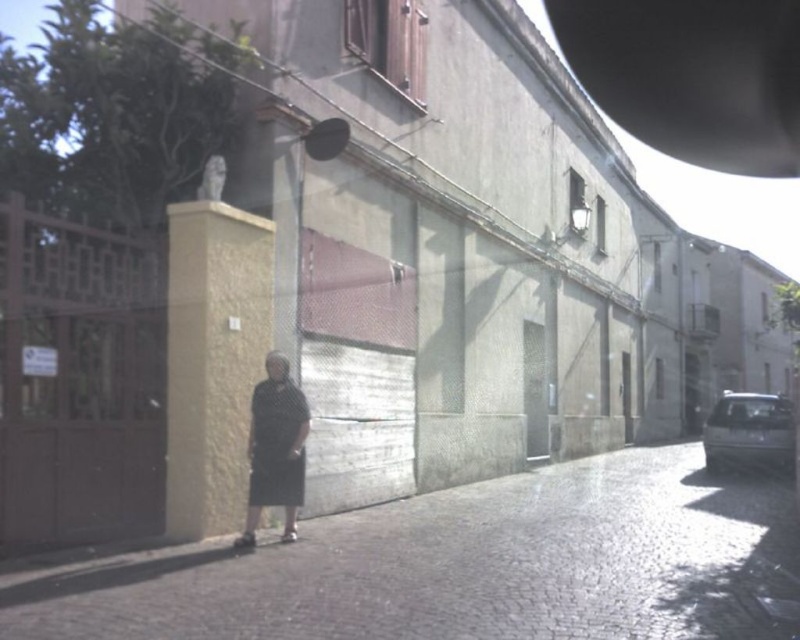
Consider the image. Can you confirm if dark gray cobblestone pavement at center is positioned to the right of black matte dress at lower center?

Correct, you'll find dark gray cobblestone pavement at center to the right of black matte dress at lower center.

Does dark gray cobblestone pavement at center come in front of black matte dress at lower center?

Yes, it is in front of black matte dress at lower center.

Does point (652, 584) lie behind point (270, 406)?

No, (652, 584) is in front of (270, 406).

Image resolution: width=800 pixels, height=640 pixels. What are the coordinates of `dark gray cobblestone pavement at center` in the screenshot? It's located at (470, 566).